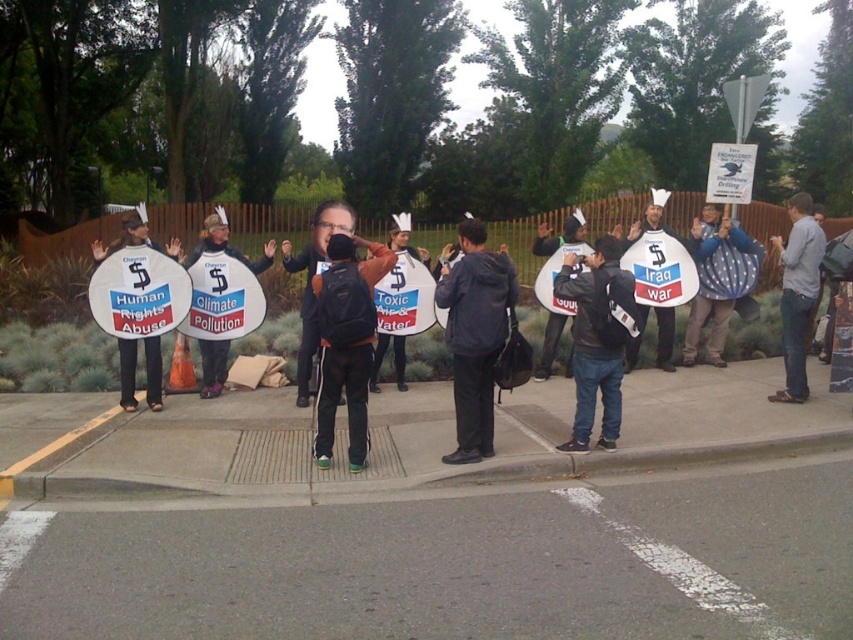
Is gray fabric shirt at right bigger than matte white sign at left?

Indeed, gray fabric shirt at right has a larger size compared to matte white sign at left.

Which is in front, point (810, 305) or point (120, 339)?

Point (810, 305) is more forward.

Who is more forward, (799, 230) or (135, 220)?

Point (799, 230) is in front.

Find the location of a particular element. gray fabric shirt at right is located at coordinates click(798, 292).

Measure the distance between dark gray jacket at center and matte white sign at left.

They are 4.58 meters apart.

Does dark gray jacket at center appear on the left side of matte white sign at left?

No, dark gray jacket at center is not to the left of matte white sign at left.

Measure the distance between point (585, 289) and camera.

21.35 feet

Locate an element on the screen. dark gray jacket at center is located at coordinates (596, 339).

Can you confirm if matte white sign at left is positioned to the left of white paper sign at center?

Indeed, matte white sign at left is positioned on the left side of white paper sign at center.

Which is more to the right, matte white sign at left or white paper sign at center?

white paper sign at center

The height and width of the screenshot is (640, 853). Describe the element at coordinates (134, 240) in the screenshot. I see `matte white sign at left` at that location.

What are the coordinates of `matte white sign at left` in the screenshot? It's located at (134, 240).